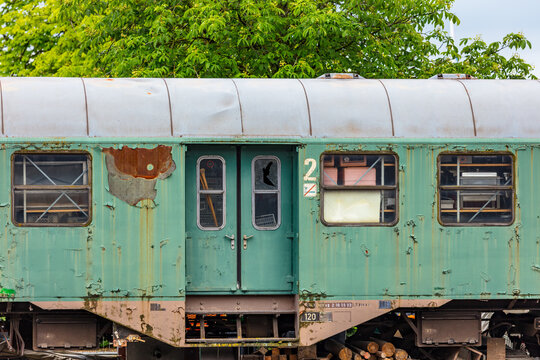
Find the location of `window panes of door`. window panes of door is located at coordinates (213, 206), (214, 171), (268, 172), (265, 211).